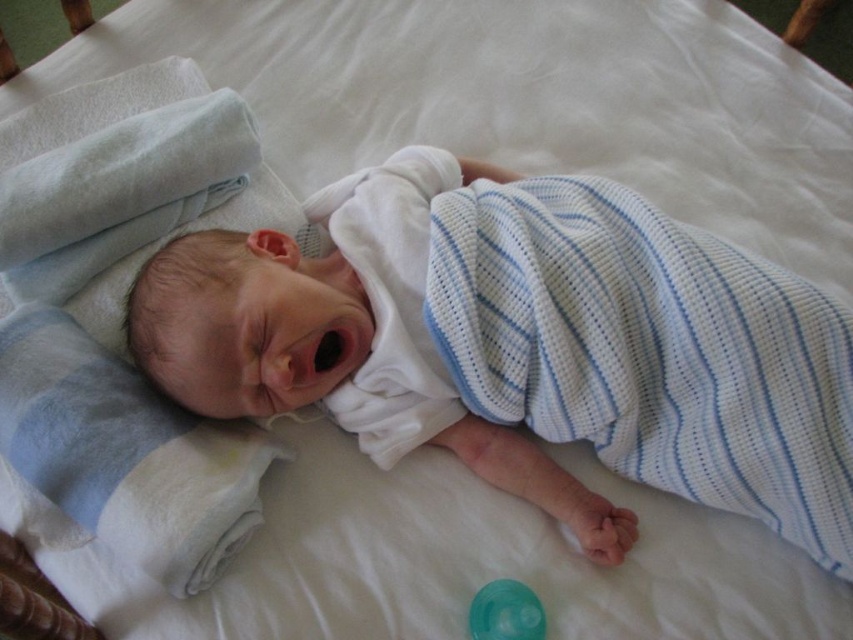
Question: Is blue striped swaddle at upper left positioned at the back of transparent plastic pacifier at center?

Choices:
 (A) no
 (B) yes

Answer: (A)

Question: Which point is farther to the camera?

Choices:
 (A) (111, 545)
 (B) (538, 611)

Answer: (B)

Question: Can you confirm if blue striped swaddle at upper left is positioned below transparent plastic pacifier at center?

Choices:
 (A) yes
 (B) no

Answer: (B)

Question: Observing the image, what is the correct spatial positioning of blue striped swaddle at upper left in reference to transparent plastic pacifier at center?

Choices:
 (A) above
 (B) below

Answer: (A)